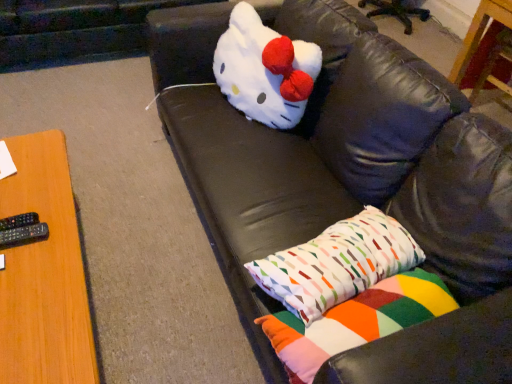
You are a GUI agent. You are given a task and a screenshot of the screen. Output one action in this format:
    pyautogui.click(x=<x>, y=<y>)
    Task: Click on the unoccupied space behind black plastic remote at left, the 2th remote positioned from the top
    Image resolution: width=512 pixels, height=384 pixels.
    Given the screenshot: What is the action you would take?
    pyautogui.click(x=32, y=198)